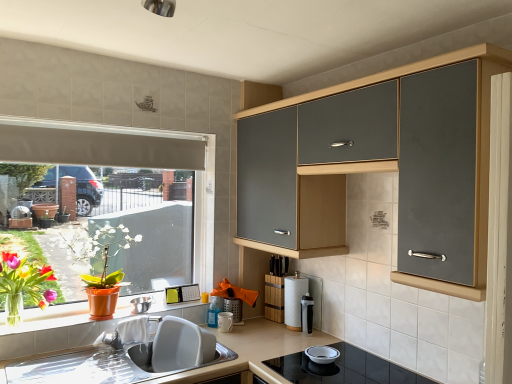
Image resolution: width=512 pixels, height=384 pixels. Find the location of `free point above orange plastic at lower left (from a real-world perspective)`. free point above orange plastic at lower left (from a real-world perspective) is located at coordinates (102, 320).